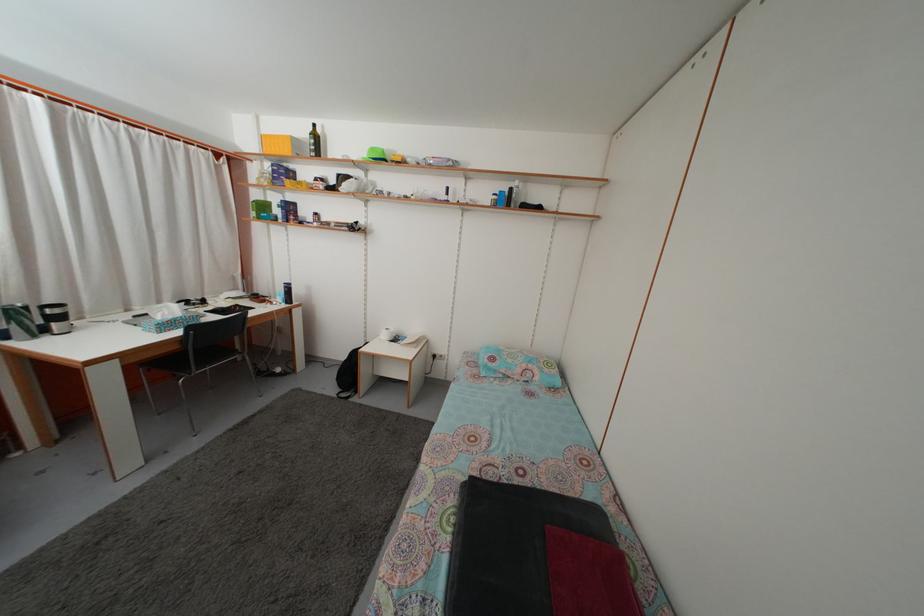
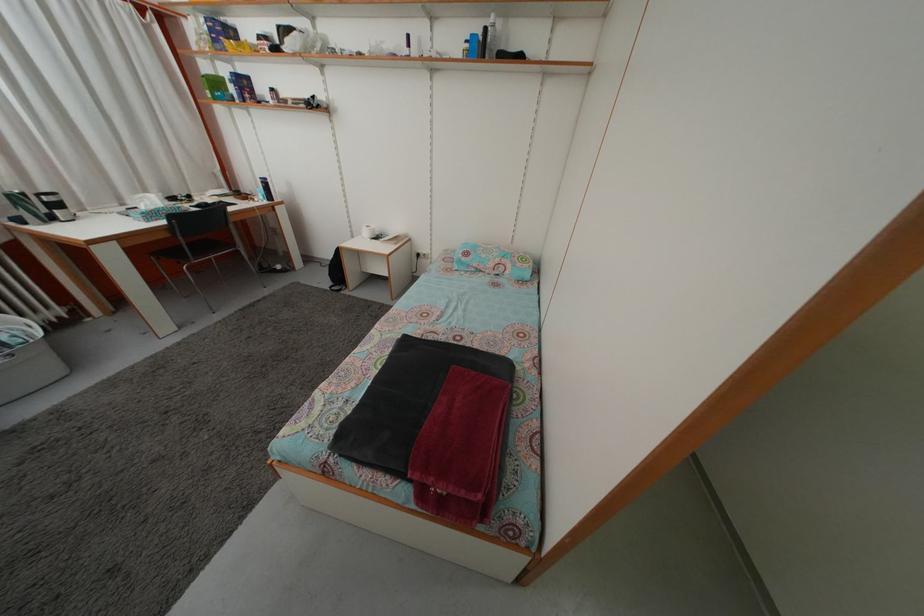
Locate, in the second image, the point that corresponds to the point at 270,214 in the first image.

(223, 91)